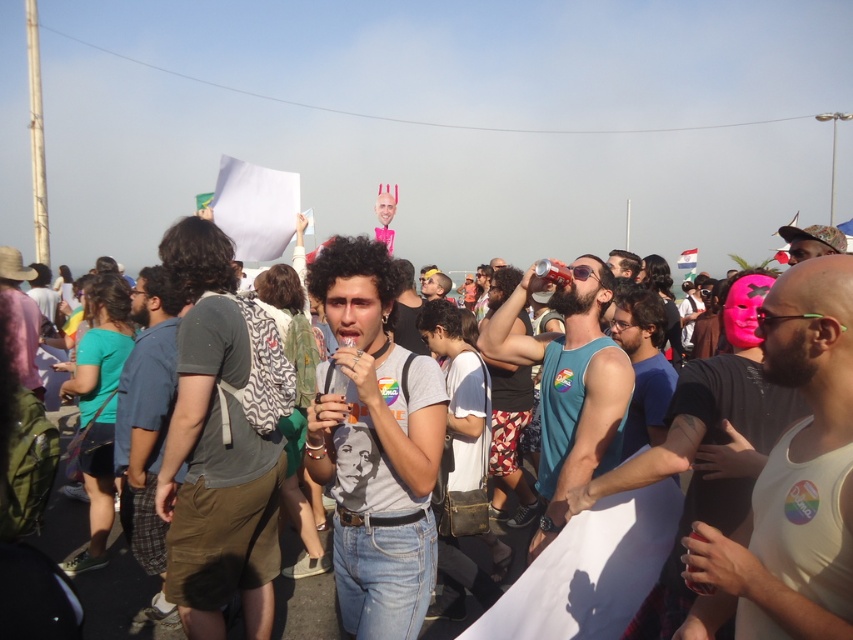
Can you confirm if dark gray cotton t-shirt at center is shorter than matte blue tank top at center?

In fact, dark gray cotton t-shirt at center may be taller than matte blue tank top at center.

Who is more forward, (184,243) or (532,541)?

Point (532,541)

Between point (207, 492) and point (567, 474), which one is positioned in front?

Positioned in front is point (567, 474).

Find the location of a particular element. The width and height of the screenshot is (853, 640). dark gray cotton t-shirt at center is located at coordinates (215, 451).

Which is in front, point (358, 275) or point (166, 604)?

Point (358, 275) is in front.

How much distance is there between matte gray t-shirt at center and blue denim jeans at center?

matte gray t-shirt at center is 5.51 feet away from blue denim jeans at center.

Identify the location of matte gray t-shirt at center. Image resolution: width=853 pixels, height=640 pixels. (374, 445).

Measure the distance between pink matte mask at center and blue denim jeans at center.

pink matte mask at center is 9.80 feet away from blue denim jeans at center.

Between pink matte mask at center and blue denim jeans at center, which one appears on the right side from the viewer's perspective?

pink matte mask at center

Does point (671, 624) lie behind point (125, 436)?

That is False.

This screenshot has width=853, height=640. What are the coordinates of `pink matte mask at center` in the screenshot? It's located at (705, 460).